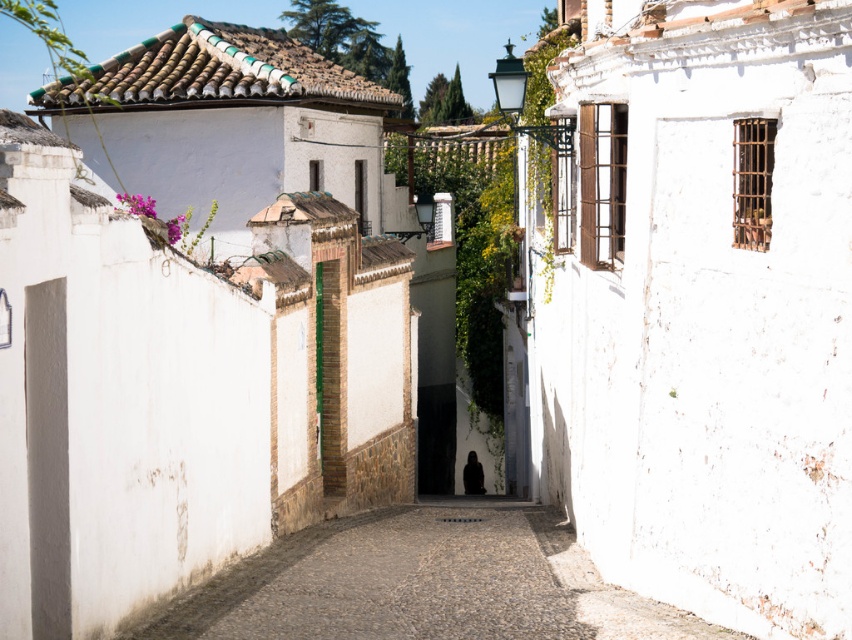
Looking at this image, you are a painter who wants to paint a mural on the white textured wall at right and the white stone alley at center. Which surface will require more vertical space due to its height?

The white textured wall at right has a greater height compared to the white stone alley at center, so it will require more vertical space for the mural.

You are standing in the middle of the alleyway and want to take a photo of the white textured wall at right. Where should you position yourself to capture it in the frame?

You should position yourself to the left of the alleyway since the white textured wall at right is located at point (699,305), which is on the right side of the alley.